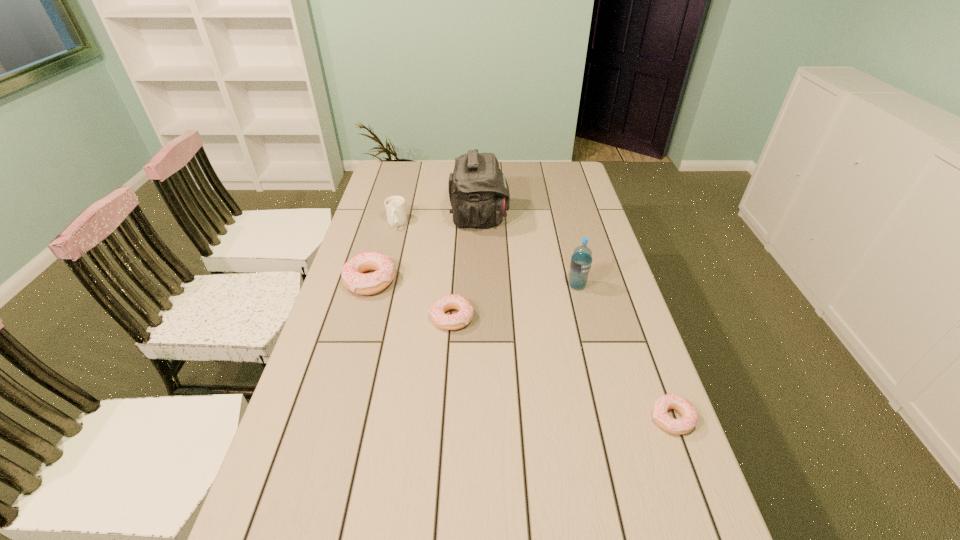
Where is `the farthest doughnut`? the farthest doughnut is located at coordinates (353, 278).

This screenshot has height=540, width=960. Find the location of `the leftmost doughnut`. the leftmost doughnut is located at coordinates (353, 278).

The image size is (960, 540). In order to click on the second doughnut from left to right in this screenshot , I will do `click(462, 318)`.

Where is `the second shortest doughnut`? The height and width of the screenshot is (540, 960). the second shortest doughnut is located at coordinates (462, 318).

Find the location of `the nearest doughnut`. the nearest doughnut is located at coordinates (689, 420).

At what (x,y) coordinates should I click in order to perform the action: click on the rightmost doughnut. Please return your answer as a coordinate pair (x, y). Looking at the image, I should click on (689, 420).

This screenshot has height=540, width=960. In order to click on shoulder bag in this screenshot , I will do `click(479, 195)`.

Image resolution: width=960 pixels, height=540 pixels. In order to click on the fourth shortest object in this screenshot , I will do `click(395, 207)`.

Locate an element on the screen. Image resolution: width=960 pixels, height=540 pixels. the fifth shortest object is located at coordinates (581, 260).

Locate an element on the screen. The image size is (960, 540). water bottle is located at coordinates (581, 260).